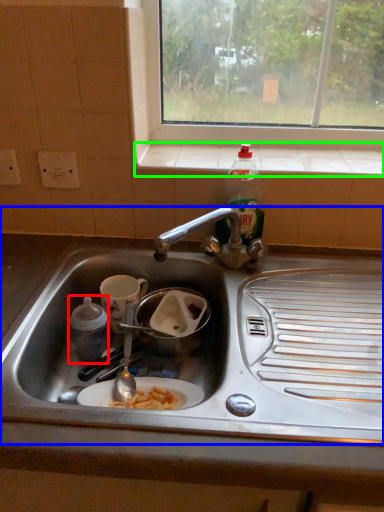
Question: Which object is positioned farthest from coffee cup (highlighted by a red box)? Select from sink (highlighted by a blue box) and window sill (highlighted by a green box).

Choices:
 (A) sink
 (B) window sill

Answer: (B)